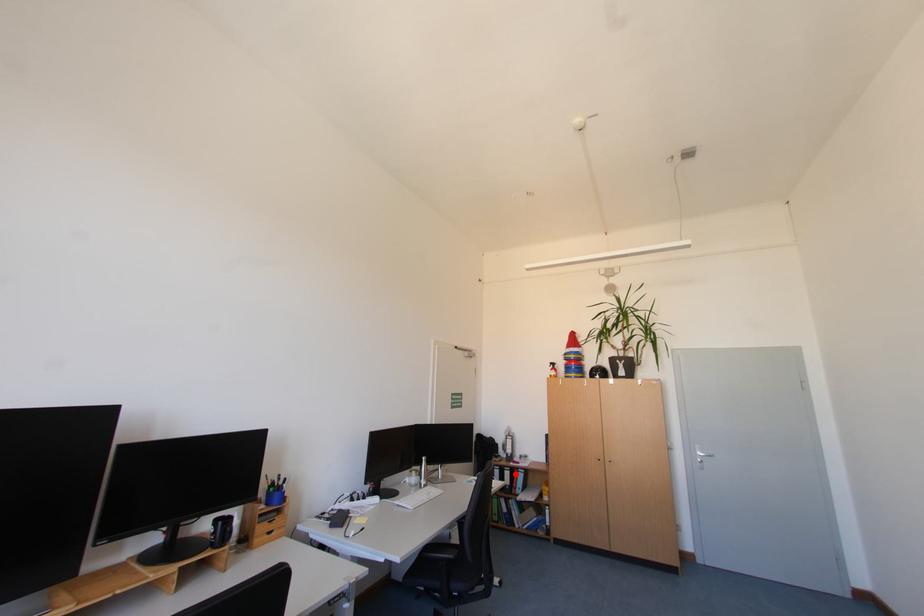
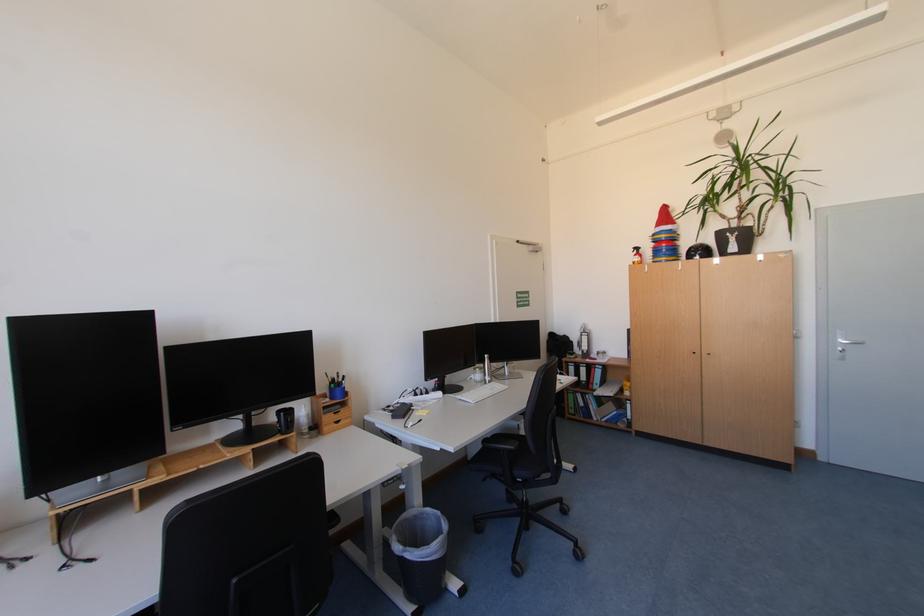
Question: I am providing you with two images of the same scene from different viewpoints. Given a red point in image1, look at the same physical point in image2. Is it:

Choices:
 (A) Closer to the viewpoint
 (B) Farther from the viewpoint

Answer: (A)